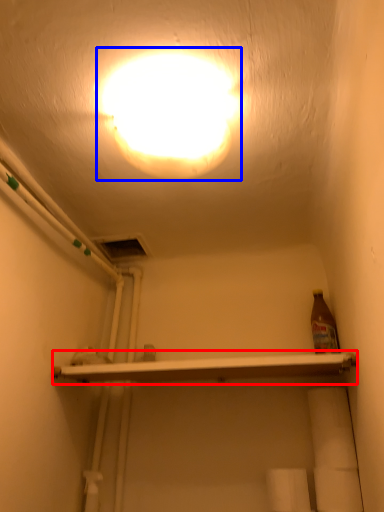
Question: Which of the following is the closest to the observer, shelf (highlighted by a red box) or lamp (highlighted by a blue box)?

Choices:
 (A) shelf
 (B) lamp

Answer: (B)